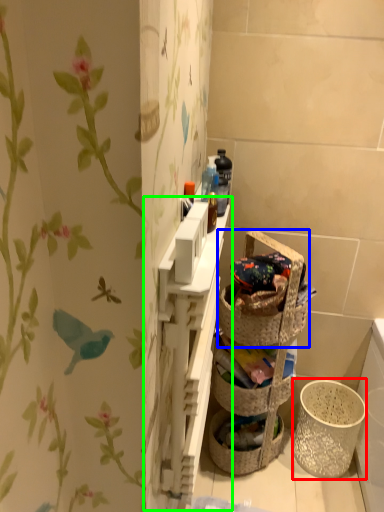
Question: Which object is the closest to the basket container (highlighted by a red box)? Choose among these: picnic basket (highlighted by a blue box) or cabinet (highlighted by a green box).

Choices:
 (A) picnic basket
 (B) cabinet

Answer: (A)